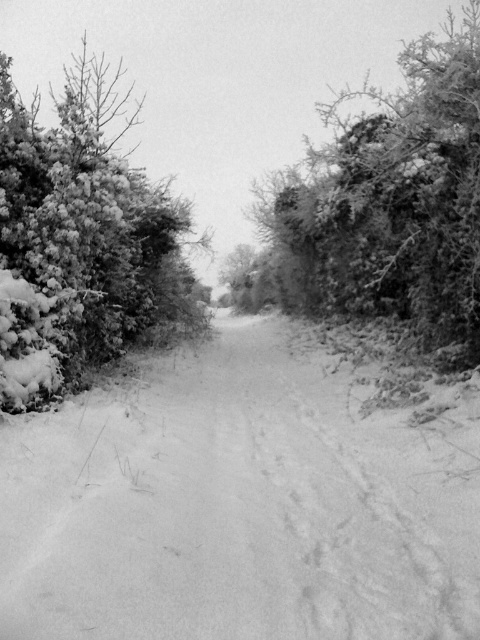
Is snow-covered bush at left above snow-covered bush at right?

No, snow-covered bush at left is not above snow-covered bush at right.

Looking at this image, is snow-covered bush at left smaller than snow-covered bush at right?

Indeed, snow-covered bush at left has a smaller size compared to snow-covered bush at right.

Between point (112, 323) and point (297, 291), which one is positioned in front?

Point (112, 323)

The height and width of the screenshot is (640, 480). What are the coordinates of `snow-covered bush at left` in the screenshot? It's located at (82, 237).

Who is higher up, white powdery snow at center or snow-covered bush at left?

Positioned higher is snow-covered bush at left.

Does point (300, 413) come in front of point (170, 278)?

Yes, it is.

Who is more distant from viewer, [336,472] or [173,332]?

The point [173,332] is more distant.

You are a GUI agent. You are given a task and a screenshot of the screen. Output one action in this format:
    pyautogui.click(x=<x>, y=<y>)
    Task: Click on the white powdery snow at center
    
    Given the screenshot: What is the action you would take?
    pyautogui.click(x=245, y=499)

Who is positioned more to the left, white powdery snow at center or snow-covered bush at right?

Positioned to the left is white powdery snow at center.

Which is below, white powdery snow at center or snow-covered bush at right?

white powdery snow at center is lower down.

Does point (15, 588) come behind point (460, 246)?

No, (15, 588) is closer to viewer.

This screenshot has width=480, height=640. I want to click on white powdery snow at center, so click(245, 499).